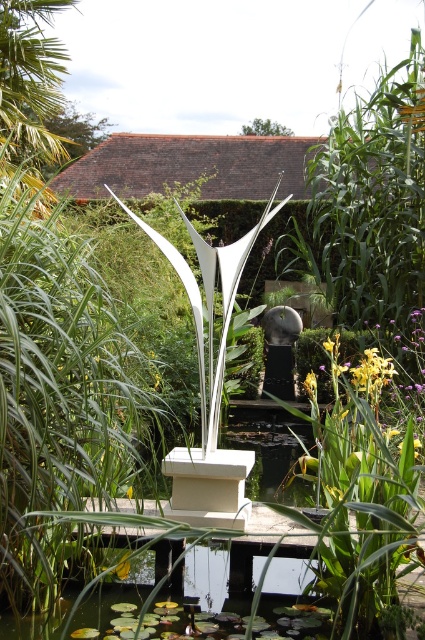
Question: Can you confirm if white glossy sculpture at center is positioned to the left of satin silver sculpture at center?

Choices:
 (A) no
 (B) yes

Answer: (B)

Question: Which point appears farthest from the camera in this image?

Choices:
 (A) (220, 360)
 (B) (294, 326)

Answer: (B)

Question: Which point is farther to the camera?

Choices:
 (A) white glossy sculpture at center
 (B) satin silver sculpture at center

Answer: (B)

Question: Does white glossy sculpture at center lie in front of satin silver sculpture at center?

Choices:
 (A) no
 (B) yes

Answer: (B)

Question: Is white glossy sculpture at center wider than satin silver sculpture at center?

Choices:
 (A) no
 (B) yes

Answer: (B)

Question: Among these points, which one is nearest to the camera?

Choices:
 (A) (235, 248)
 (B) (278, 340)

Answer: (A)